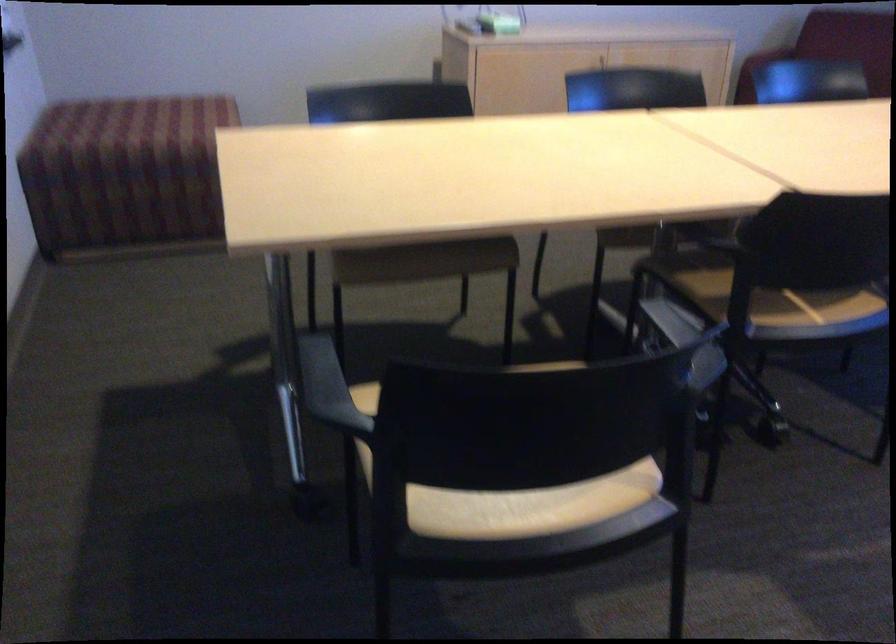
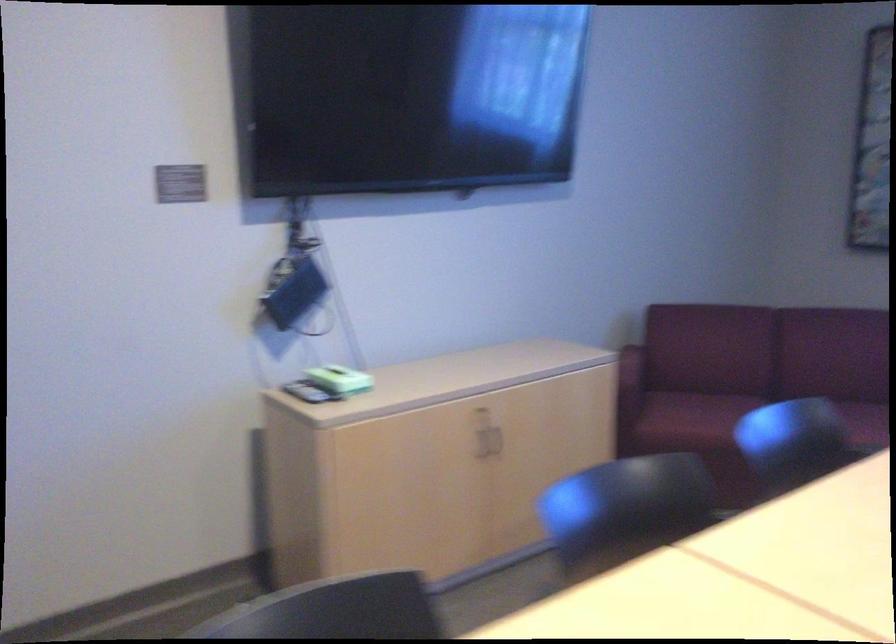
Question: Which direction would the cameraman need to move to produce the second image? Reply with the corresponding letter.

Choices:
 (A) Left
 (B) Right
 (C) Forward
 (D) Backward

Answer: (C)